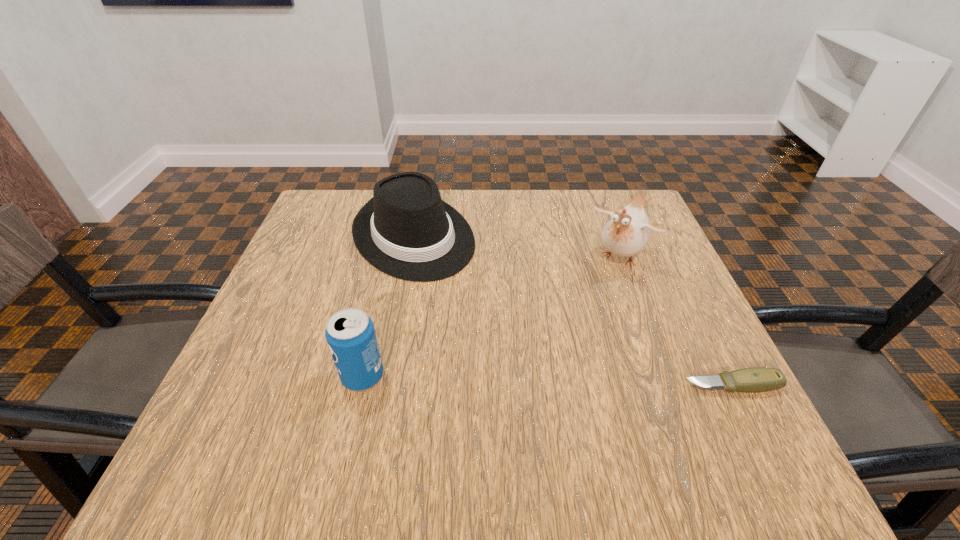
You are a GUI agent. You are given a task and a screenshot of the screen. Output one action in this format:
    pyautogui.click(x=<x>, y=<y>)
    Task: Click on the free space located 0.380m on the front-facing side of the fedora
    Image resolution: width=960 pixels, height=540 pixels.
    Given the screenshot: What is the action you would take?
    pyautogui.click(x=549, y=397)

Where is `vacant space located 0.370m on the front-facing side of the fedora`? Image resolution: width=960 pixels, height=540 pixels. vacant space located 0.370m on the front-facing side of the fedora is located at coordinates (546, 393).

Identify the location of bird present at the far edge. point(626,233).

You are a GUI agent. You are given a task and a screenshot of the screen. Output one action in this format:
    pyautogui.click(x=<x>, y=<y>)
    Task: Click on the fedora present at the far edge
    This screenshot has height=540, width=960.
    Given the screenshot: What is the action you would take?
    pyautogui.click(x=406, y=230)

Find the location of `soda can that is positioned at the near edge`. soda can that is positioned at the near edge is located at coordinates (350, 334).

Where is `pocketknife that is at the near edge`? This screenshot has height=540, width=960. pocketknife that is at the near edge is located at coordinates (757, 379).

Identify the location of object located in the left edge section of the desktop. The width and height of the screenshot is (960, 540). (406, 230).

Locate an element on the screen. pocketknife located in the right edge section of the desktop is located at coordinates 757,379.

Locate an element on the screen. bird at the right edge is located at coordinates (626, 233).

Find the location of a particular element. The width and height of the screenshot is (960, 540). object present at the far left corner is located at coordinates (406, 230).